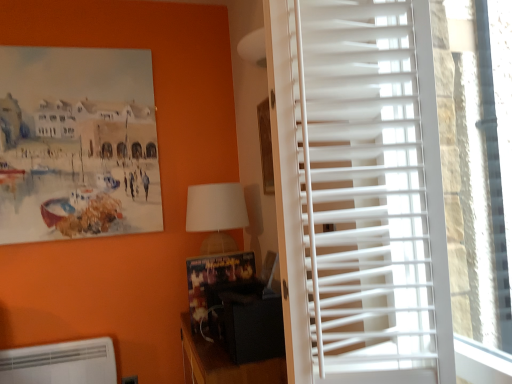
Locate an element on the screen. This screenshot has height=384, width=512. white plastic blinds at right is located at coordinates (360, 192).

Consider the image. Measure the distance between point (492, 235) and camera.

Point (492, 235) and camera are 1.24 meters apart.

Measure the distance between point (7,365) and camera.

The depth of point (7,365) is 2.07 meters.

Identify the location of wooden bulletin board at center. This screenshot has width=512, height=384. (x=216, y=286).

Is white plastic air conditioning unit at lower left completely or partially outside of wooden bulletin board at center?

Yes, white plastic air conditioning unit at lower left is outside of wooden bulletin board at center.

From a real-world perspective, which object stands above the other?

In real-world perspective, wooden bulletin board at center is above.

Is white plastic air conditioning unit at lower left positioned far away from wooden bulletin board at center?

No, white plastic air conditioning unit at lower left is not far away from wooden bulletin board at center.

Is wooden picture frame at upper center taller than wooden bulletin board at center?

Indeed, wooden picture frame at upper center has a greater height compared to wooden bulletin board at center.

Considering the points (271, 168) and (250, 259), which point is in front, point (271, 168) or point (250, 259)?

Point (250, 259)

Could you tell me if wooden picture frame at upper center is facing wooden bulletin board at center?

No, wooden picture frame at upper center is not turned towards wooden bulletin board at center.

Is wooden picture frame at upper center facing away from white plastic blinds at right?

No, wooden picture frame at upper center is not facing the opposite direction of white plastic blinds at right.

Is wooden picture frame at upper center closer to the viewer compared to white plastic blinds at right?

No, wooden picture frame at upper center is behind white plastic blinds at right.

Between point (266, 168) and point (480, 73), which one is positioned in front?

The point (480, 73) is more forward.

How much distance is there between wooden picture frame at upper center and white plastic blinds at right?

wooden picture frame at upper center and white plastic blinds at right are 93.22 centimeters apart.

Can you tell me how much white plastic air conditioning unit at lower left and black matte speaker at lower center differ in facing direction?

white plastic air conditioning unit at lower left and black matte speaker at lower center are facing 89.6 degrees away from each other.

Is white plastic air conditioning unit at lower left at the right side of black matte speaker at lower center?

In fact, white plastic air conditioning unit at lower left is to the left of black matte speaker at lower center.

Measure the distance between white plastic air conditioning unit at lower left and black matte speaker at lower center.

29.00 inches.

Based on the photo, from a real-world perspective, between white plastic air conditioning unit at lower left and black matte speaker at lower center, who is vertically higher?

In real-world perspective, black matte speaker at lower center is above.

From a real-world perspective, relative to wooden picture frame at upper center, is wooden bulletin board at center vertically above or below?

Clearly, from a real-world perspective, wooden bulletin board at center is below wooden picture frame at upper center.

Which object is further away from the camera, wooden bulletin board at center or wooden picture frame at upper center?

wooden bulletin board at center is further away from the camera.

Which of these two, wooden bulletin board at center or wooden picture frame at upper center, is bigger?

wooden bulletin board at center is bigger.

Which is closer, (x=218, y=274) or (x=261, y=133)?

The point (x=218, y=274) is in front.

From the image's perspective, is wooden bulletin board at center beneath white plastic blinds at right?

Indeed, from the image's perspective, wooden bulletin board at center is shown beneath white plastic blinds at right.

Which is correct: wooden bulletin board at center is inside white plastic blinds at right, or outside of it?

The correct answer is: outside.

Considering the relative sizes of wooden bulletin board at center and white plastic blinds at right in the image provided, is wooden bulletin board at center bigger than white plastic blinds at right?

No, wooden bulletin board at center is not bigger than white plastic blinds at right.

How many degrees apart are the facing directions of wooden bulletin board at center and white plastic air conditioning unit at lower left?

87.7 degrees separate the facing orientations of wooden bulletin board at center and white plastic air conditioning unit at lower left.

From a real-world perspective, between wooden bulletin board at center and white plastic air conditioning unit at lower left, who is vertically lower?

white plastic air conditioning unit at lower left is physically lower.

In the scene shown: Can you confirm if wooden bulletin board at center is thinner than white plastic air conditioning unit at lower left?

No.

Is wooden bulletin board at center positioned with its back to white plastic air conditioning unit at lower left?

No, wooden bulletin board at center is not facing the opposite direction of white plastic air conditioning unit at lower left.

Identify the location of bulletin board on the right of the white plastic air conditioning unit at lower left. The image size is (512, 384). (216, 286).

Where is `bulletin board behind the wooden picture frame at upper center`? This screenshot has width=512, height=384. bulletin board behind the wooden picture frame at upper center is located at coordinates (216, 286).

Considering their positions, is wooden bulletin board at center positioned closer to white plastic blinds at right than white plastic blinds at right?

Based on the image, white plastic blinds at right appears to be nearer to white plastic blinds at right.

Looking at the image, which one is located further to white fabric lampshade at center, wooden picture frame at upper center or white plastic air conditioning unit at lower left?

white plastic air conditioning unit at lower left lies further to white fabric lampshade at center than the other object.

From the image, which object appears to be farther from black matte speaker at lower center, white plastic blinds at right or white plastic blinds at right?

white plastic blinds at right.

Looking at the image, which one is located closer to white plastic blinds at right, black matte speaker at lower center or white plastic air conditioning unit at lower left?

black matte speaker at lower center is positioned closer to the anchor white plastic blinds at right.

Estimate the real-world distances between objects in this image. Which object is further from white fabric lampshade at center, white plastic air conditioning unit at lower left or wooden picture frame at upper center?

Among the two, white plastic air conditioning unit at lower left is located further to white fabric lampshade at center.

Which object lies nearer to the anchor point white fabric lampshade at center, black matte speaker at lower center or white plastic air conditioning unit at lower left?

Among the two, black matte speaker at lower center is located nearer to white fabric lampshade at center.

Looking at the image, which one is located further to white plastic blinds at right, wooden picture frame at upper center or black matte speaker at lower center?

wooden picture frame at upper center.

When comparing their distances from white plastic air conditioning unit at lower left, does wooden bulletin board at center or wooden picture frame at upper center seem further?

wooden picture frame at upper center is further to white plastic air conditioning unit at lower left.

You are a GUI agent. You are given a task and a screenshot of the screen. Output one action in this format:
    pyautogui.click(x=<x>, y=<y>)
    Task: Click on the window screen between white plastic blinds at right and wooden bulletin board at center along the z-axis
    
    Given the screenshot: What is the action you would take?
    pyautogui.click(x=476, y=161)

Locate an element on the screen. Image resolution: width=512 pixels, height=384 pixels. bulletin board between wooden picture frame at upper center and white plastic air conditioning unit at lower left in the vertical direction is located at coordinates (216, 286).

Identify the location of window screen located between white plastic blinds at right and white fabric lampshade at center in the depth direction. The image size is (512, 384). (476, 161).

You are a GUI agent. You are given a task and a screenshot of the screen. Output one action in this format:
    pyautogui.click(x=<x>, y=<y>)
    Task: Click on the picture frame located between white plastic air conditioning unit at lower left and white plastic blinds at right in the left-right direction
    
    Given the screenshot: What is the action you would take?
    pyautogui.click(x=266, y=146)